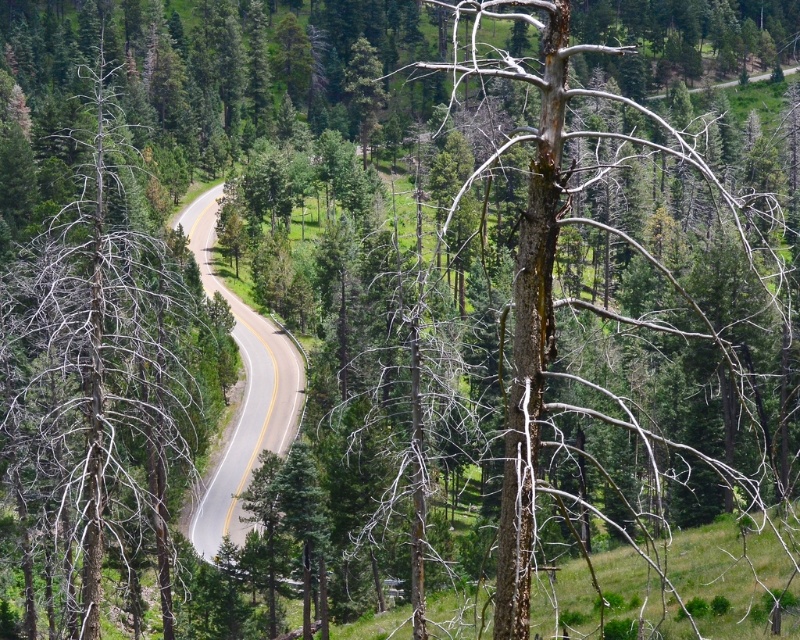
You are a hiker standing at point (272, 429) and want to reach point (214, 348). Given the road curves gently towards the background, which direction should you walk to get there?

Since point (214, 348) is behind point (272, 429), you should walk in the direction the road curves towards the background to reach it.

You are a hiker standing on the asphalt road at center. You look towards the dead wood tree at left. Which object is taller?

The dead wood tree at left is taller than the asphalt road at center.